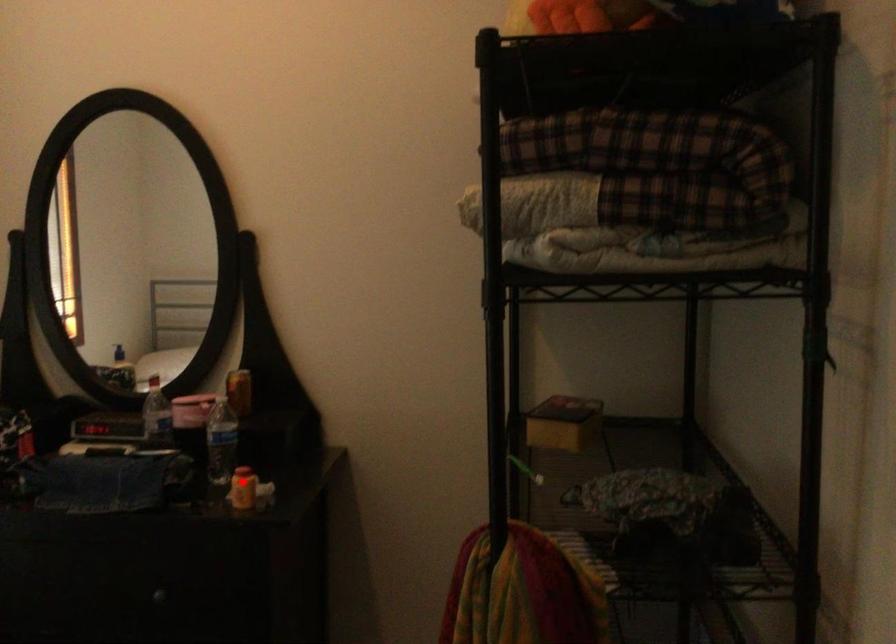
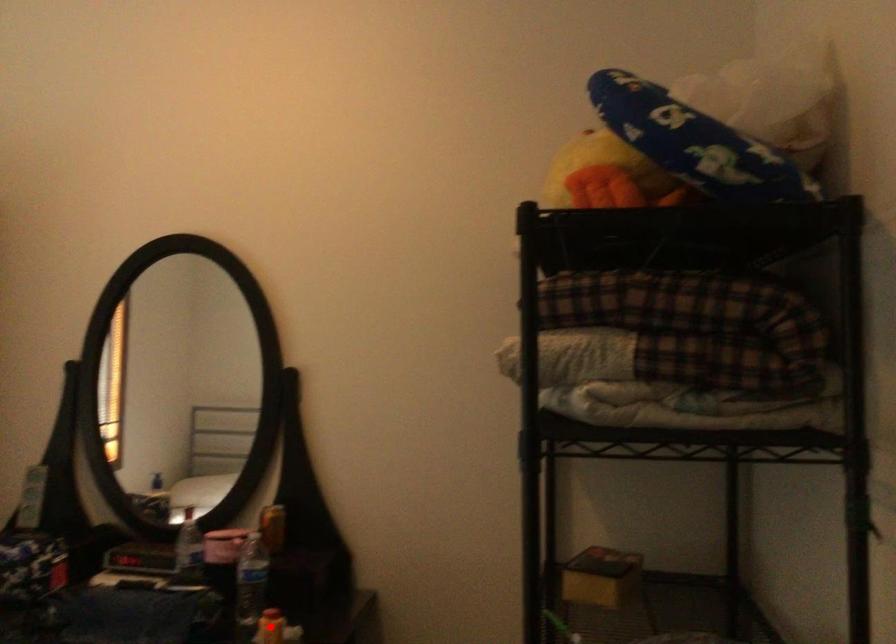
Consider the image. I am providing you with two images of the same scene from different viewpoints. A red point is marked on the first image and another point is marked on the second image. Is the marked point in image1 the same physical position as the marked point in image2?

Yes